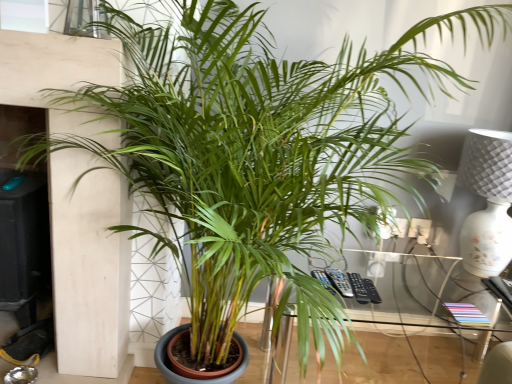
Question: Is transparent glass table at center beside white textured lamp at right?

Choices:
 (A) yes
 (B) no

Answer: (B)

Question: Is transparent glass table at center taller than white textured lamp at right?

Choices:
 (A) yes
 (B) no

Answer: (B)

Question: Is transparent glass table at center at the right side of white textured lamp at right?

Choices:
 (A) no
 (B) yes

Answer: (A)

Question: From the image's perspective, is transparent glass table at center above white textured lamp at right?

Choices:
 (A) no
 (B) yes

Answer: (A)

Question: Could white textured lamp at right be considered to be inside transparent glass table at center?

Choices:
 (A) yes
 (B) no

Answer: (B)

Question: Considering the relative positions of white textured lamp at right and transparent glass table at center in the image provided, is white textured lamp at right to the left or to the right of transparent glass table at center?

Choices:
 (A) left
 (B) right

Answer: (B)

Question: Considering the positions of white textured lamp at right and transparent glass table at center in the image, is white textured lamp at right taller or shorter than transparent glass table at center?

Choices:
 (A) tall
 (B) short

Answer: (A)

Question: From a real-world perspective, relative to transparent glass table at center, is white textured lamp at right vertically above or below?

Choices:
 (A) above
 (B) below

Answer: (A)

Question: Is white textured lamp at right in front of or behind transparent glass table at center in the image?

Choices:
 (A) behind
 (B) front

Answer: (A)

Question: In terms of height, does transparent glass table at center look taller or shorter compared to clear glass window at upper center?

Choices:
 (A) short
 (B) tall

Answer: (B)

Question: From a real-world perspective, is transparent glass table at center positioned above or below clear glass window at upper center?

Choices:
 (A) below
 (B) above

Answer: (A)

Question: Based on their sizes in the image, would you say transparent glass table at center is bigger or smaller than clear glass window at upper center?

Choices:
 (A) small
 (B) big

Answer: (B)

Question: Relative to clear glass window at upper center, is transparent glass table at center in front or behind?

Choices:
 (A) behind
 (B) front

Answer: (A)

Question: Would you say clear glass window at upper center is to the left or to the right of transparent glass table at center in the picture?

Choices:
 (A) left
 (B) right

Answer: (A)

Question: Which is correct: clear glass window at upper center is inside transparent glass table at center, or outside of it?

Choices:
 (A) outside
 (B) inside

Answer: (A)